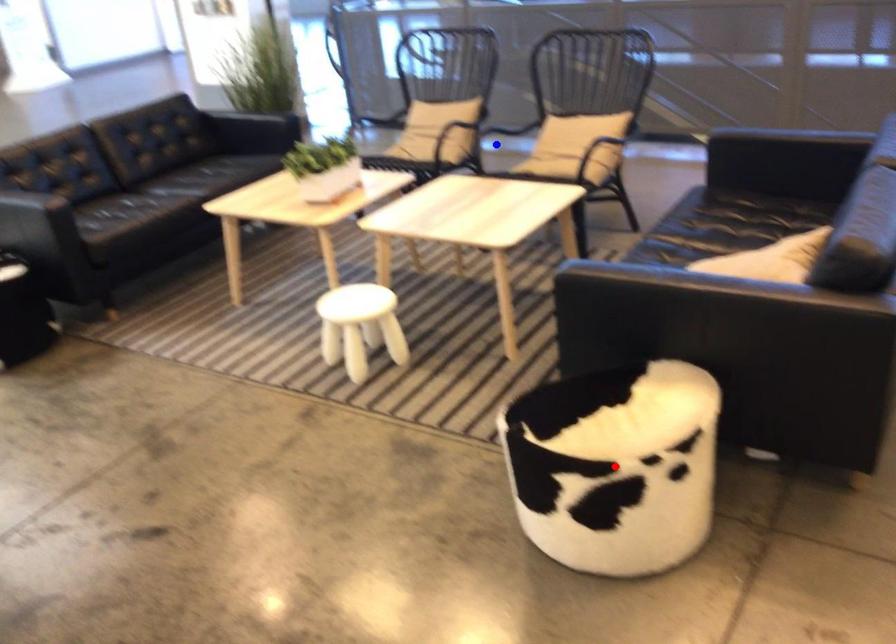
Question: Two points are marked on the image. Which point is closer to the camera?

Choices:
 (A) Blue point is closer.
 (B) Red point is closer.

Answer: (B)